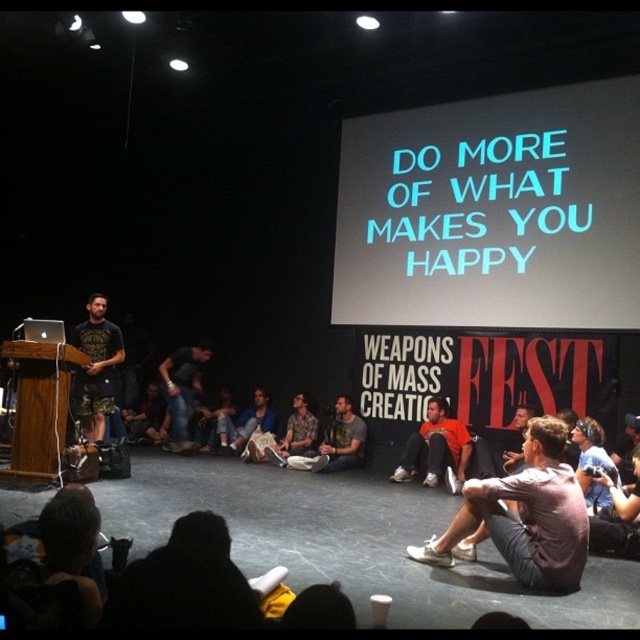
You are a stagehand preparing to set up a microphone stand between the jeans at center and the denim pants at center. The stand requires at least 1 meter of space between the two objects to be placed safely. Can you determine if there is enough space between them based on their height difference?

The jeans at center is much taller than denim pants at center, but the question is about the space between them, which isn not directly related to their height. The height difference doesn indicate the horizontal distance required for the microphone stand. Without information on their horizontal separation, we cannot determine if there is enough space.

You are standing at the point marked as point [435,448] in the image. What object is exactly at this location?

The orange cotton shirt at center is exactly at point [435,448].